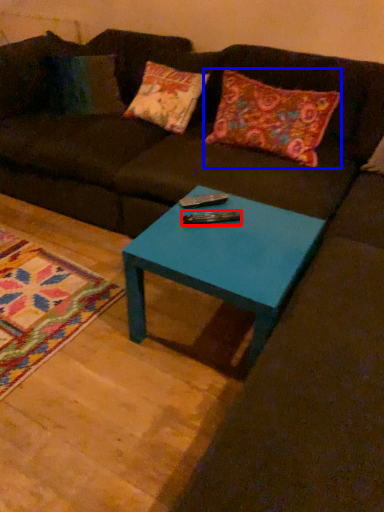
Question: Which of the following is the farthest to the observer, remote (highlighted by a red box) or pillow (highlighted by a blue box)?

Choices:
 (A) remote
 (B) pillow

Answer: (B)